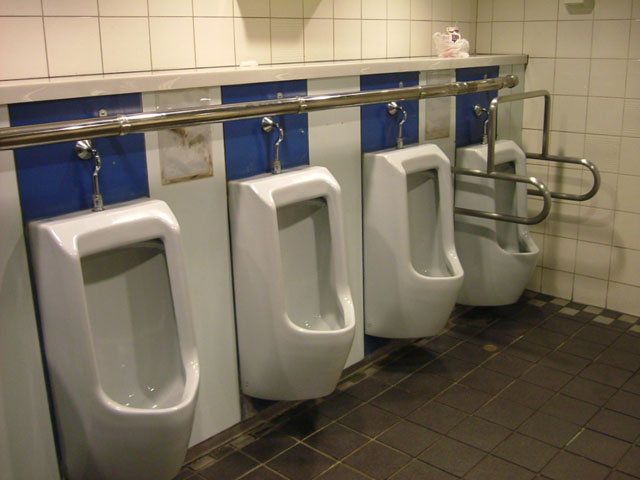
Identify the location of male toilets. (129, 220), (310, 186), (408, 165), (514, 155).